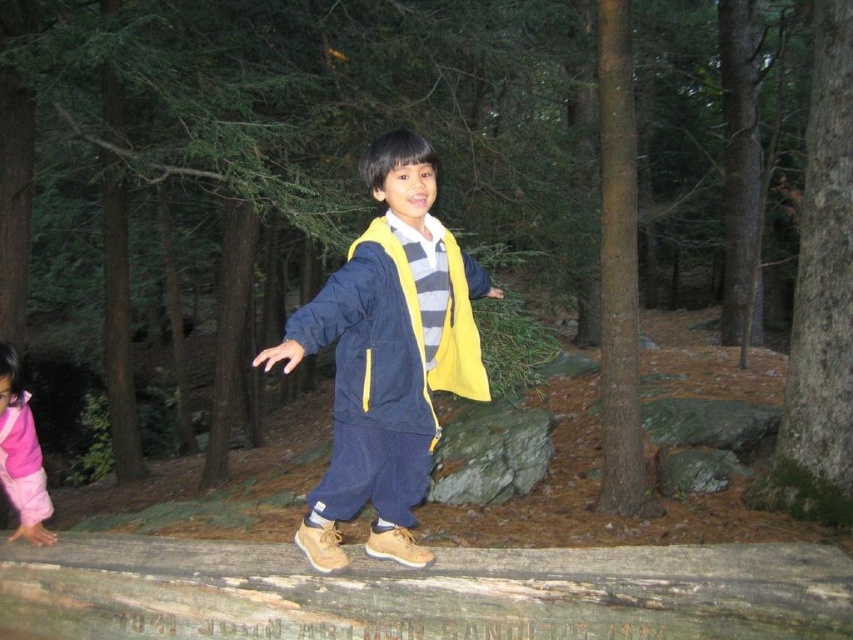
Between weathered wooden log at center and matte blue jacket at center, which one is positioned higher?

matte blue jacket at center is above.

What do you see at coordinates (422, 593) in the screenshot? I see `weathered wooden log at center` at bounding box center [422, 593].

At what (x,y) coordinates should I click in order to perform the action: click on weathered wooden log at center. Please return your answer as a coordinate pair (x, y). This screenshot has height=640, width=853. Looking at the image, I should click on (422, 593).

Does weathered wooden log at center have a lesser height compared to brown rough bark tree trunk at center-right?

Correct, weathered wooden log at center is not as tall as brown rough bark tree trunk at center-right.

Which is behind, point (550, 593) or point (619, 173)?

Point (619, 173)

Who is more distant from viewer, (x=680, y=621) or (x=625, y=460)?

Positioned behind is point (x=625, y=460).

Find the location of `weathered wooden log at center`. weathered wooden log at center is located at coordinates (422, 593).

Which is more to the right, navy blue/yellow fabric jacket at center or pink fleece pants at lower left?

navy blue/yellow fabric jacket at center is more to the right.

Does navy blue/yellow fabric jacket at center have a greater height compared to pink fleece pants at lower left?

No, navy blue/yellow fabric jacket at center is not taller than pink fleece pants at lower left.

Who is more distant from viewer, (392,332) or (33,429)?

Positioned behind is point (33,429).

I want to click on navy blue/yellow fabric jacket at center, so click(393, 333).